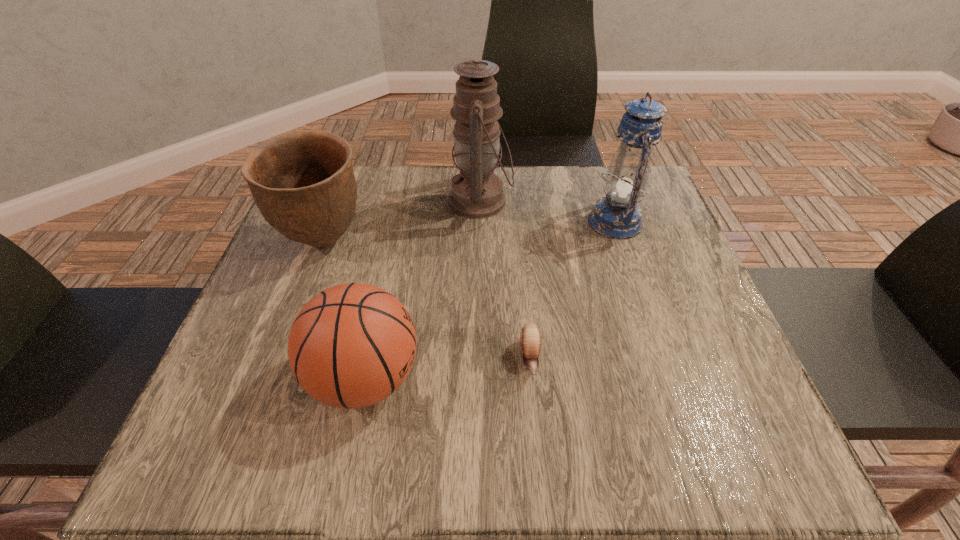
The height and width of the screenshot is (540, 960). I want to click on free location located on the surface of the basketball near the brand logo, so click(474, 377).

You are a GUI agent. You are given a task and a screenshot of the screen. Output one action in this format:
    pyautogui.click(x=<x>, y=<y>)
    Task: Click on the free space located on the front-facing side of the shortest object
    
    Given the screenshot: What is the action you would take?
    pyautogui.click(x=540, y=462)

Find the location of a particular element. Image resolution: width=960 pixels, height=540 pixels. oil lamp that is positioned at the far edge is located at coordinates 476,192.

Find the location of `lantern that is at the far edge`. lantern that is at the far edge is located at coordinates (617, 216).

You are a GUI agent. You are given a task and a screenshot of the screen. Output one action in this format:
    pyautogui.click(x=<x>, y=<y>)
    Task: Click on the pottery that is at the far edge
    
    Given the screenshot: What is the action you would take?
    pyautogui.click(x=303, y=183)

Locate an element on the screen. The height and width of the screenshot is (540, 960). object situated at the near edge is located at coordinates (352, 345).

Image resolution: width=960 pixels, height=540 pixels. Find the location of `pottery that is positioned at the left edge`. pottery that is positioned at the left edge is located at coordinates (303, 183).

The image size is (960, 540). Find the location of `basketball that is at the left edge`. basketball that is at the left edge is located at coordinates (352, 345).

Find the location of `object present at the right edge`. object present at the right edge is located at coordinates (617, 216).

I want to click on object located at the far left corner, so click(303, 183).